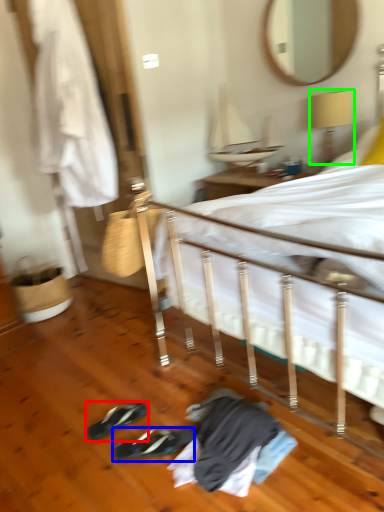
Question: Based on their relative distances, which object is farther from footwear (highlighted by a red box)? Choose from footwear (highlighted by a blue box) and lamp (highlighted by a green box).

Choices:
 (A) footwear
 (B) lamp

Answer: (B)